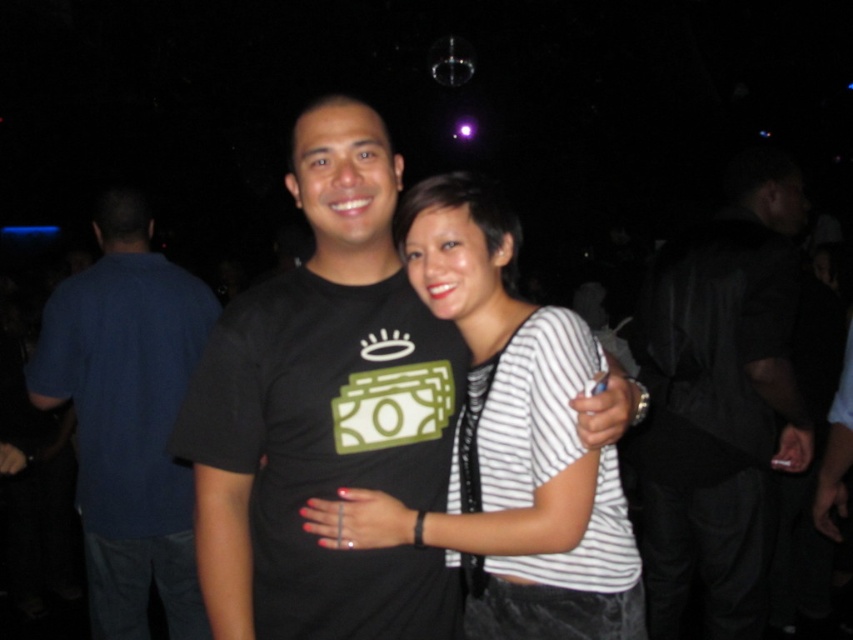
You are a photographer at this event and want to adjust your camera to focus on the white striped shirt at center without blurring the black leather jacket at right. Is this possible given their positions?

The white striped shirt at center is behind the black leather jacket at right, so adjusting the camera focus to the white striped shirt at center while keeping the black leather jacket at right in focus depends on the depth of field. If the depth of field is sufficient, both can be in focus, but if it is shallow, only the focused subject will be clear.

You are organizing a closet and have a shelf that can only hold items wider than 30 cm. You need to place the black leather jacket at right and the white striped shirt at center on this shelf. Can both items fit on the shelf if the jacket is wider than the shirt?

The black leather jacket at right is wider than the white striped shirt at center. Since the shelf requires items wider than 30 cm, we need to know the exact width of the jacket. If the jacket is wider than 30 cm, it can be placed on the shelf. However, the shirt might not qualify if its width is under 30 cm. Without specific measurements, we can only confirm the jacket is wider than the shirt, but cannot determine if both meet the 30 cm requirement.